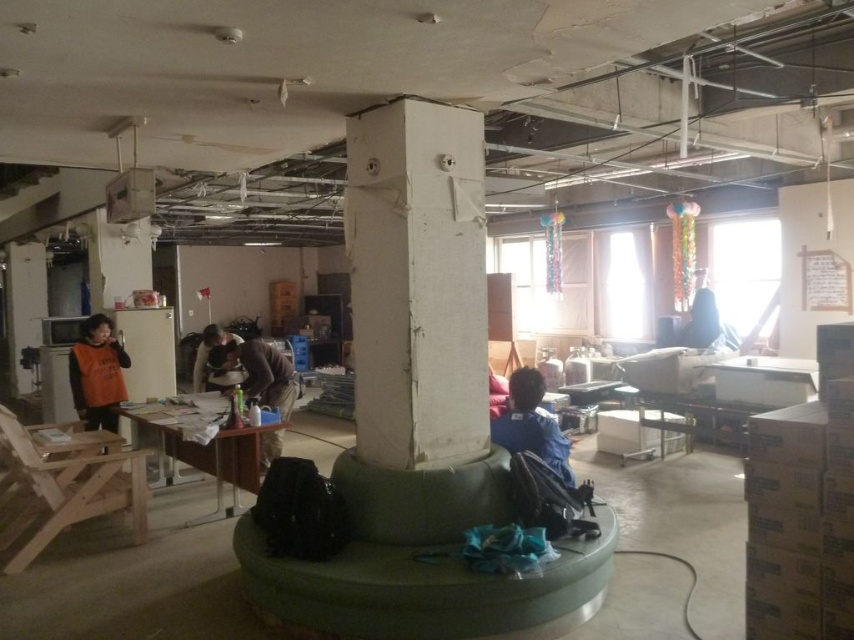
Can you confirm if brown fabric shirt at center is positioned above dark blue fabric at upper right?

Actually, brown fabric shirt at center is below dark blue fabric at upper right.

Which is behind, point (243, 342) or point (699, 321)?

The point (699, 321) is more distant.

Image resolution: width=854 pixels, height=640 pixels. Find the location of `brown fabric shirt at center`. brown fabric shirt at center is located at coordinates point(256,372).

Looking at this image, which of these two, green rubber couch at center or light brown wood chair at lower left, stands taller?

With more height is light brown wood chair at lower left.

Who is higher up, green rubber couch at center or light brown wood chair at lower left?

green rubber couch at center is above.

Image resolution: width=854 pixels, height=640 pixels. What do you see at coordinates (423, 563) in the screenshot?
I see `green rubber couch at center` at bounding box center [423, 563].

Find the location of a particular element. The image size is (854, 640). green rubber couch at center is located at coordinates pyautogui.click(x=423, y=563).

How much distance is there between green rubber couch at center and brown fabric shirt at center?

green rubber couch at center and brown fabric shirt at center are 7.94 feet apart from each other.

Is green rubber couch at center above brown fabric shirt at center?

Incorrect, green rubber couch at center is not positioned above brown fabric shirt at center.

Who is more distant from viewer, (547, 636) or (237, 362)?

Positioned behind is point (237, 362).

Locate an element on the screen. The width and height of the screenshot is (854, 640). green rubber couch at center is located at coordinates (423, 563).